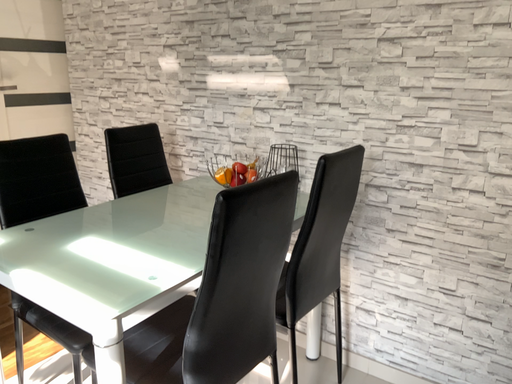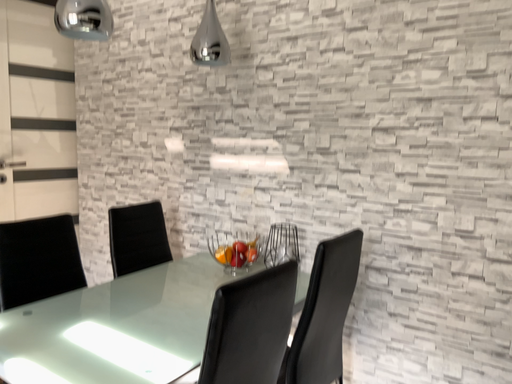
Question: Which way did the camera rotate in the video?

Choices:
 (A) rotated downward
 (B) rotated upward

Answer: (B)